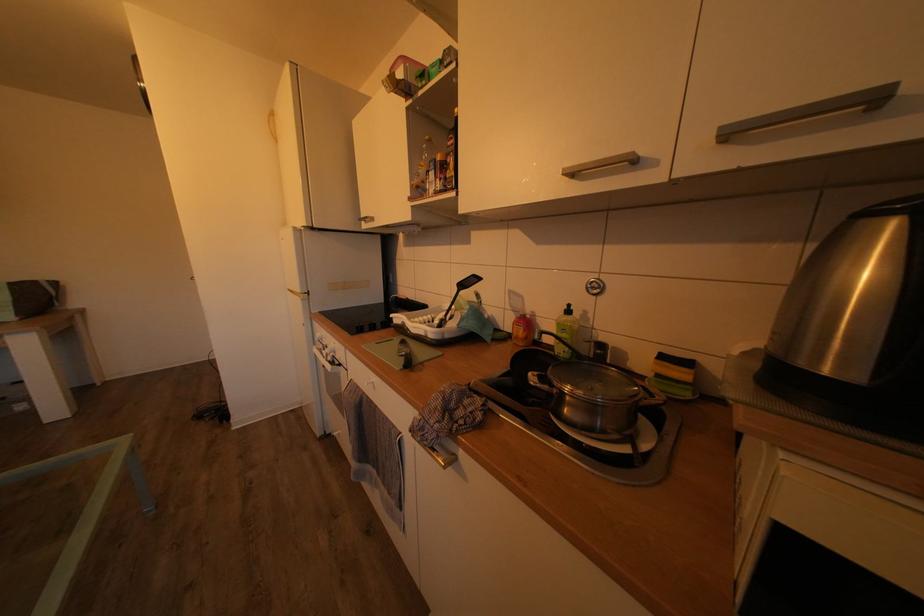
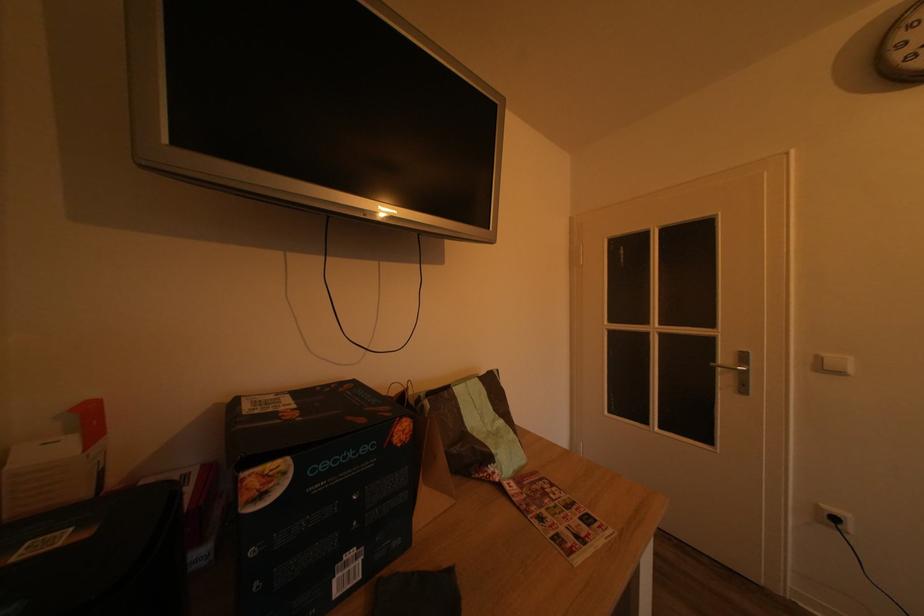
Question: In a continuous first-person perspective shot, in which direction is the camera moving?

Choices:
 (A) Left
 (B) Right
 (C) Forward
 (D) Backward

Answer: (A)